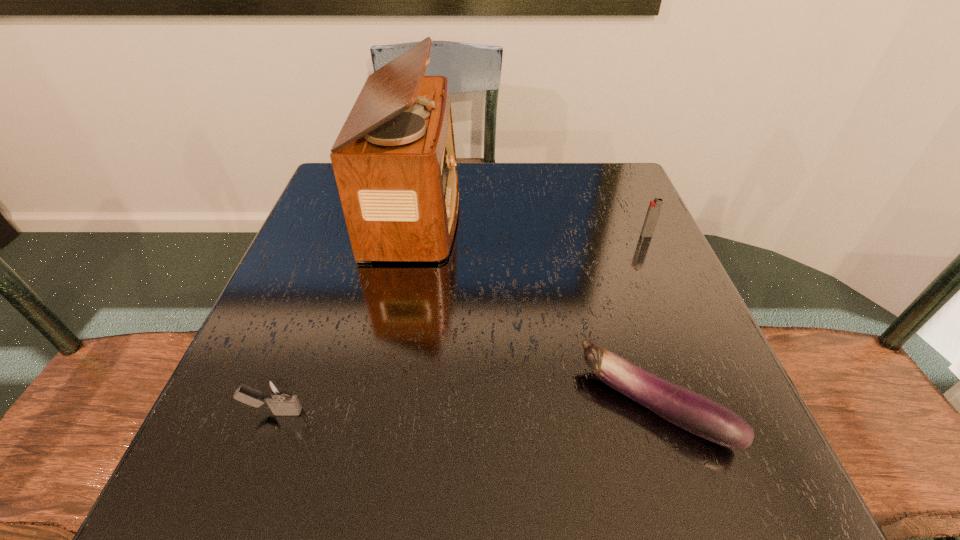
You are a GUI agent. You are given a task and a screenshot of the screen. Output one action in this format:
    pyautogui.click(x=<x>, y=<y>)
    Task: Click on the vacant space that's between the radio receiver and the nearer igniter
    Image resolution: width=960 pixels, height=540 pixels.
    Given the screenshot: What is the action you would take?
    pyautogui.click(x=345, y=312)

The image size is (960, 540). I want to click on free spot between the second object from left to right and the farther igniter, so click(x=531, y=223).

Find the location of `free space between the tallest object and the farther igniter`. free space between the tallest object and the farther igniter is located at coordinates (531, 223).

This screenshot has width=960, height=540. What are the coordinates of `vacant area between the leftmost object and the tallest object` in the screenshot? It's located at (345, 312).

The width and height of the screenshot is (960, 540). Find the location of `object that stands as the second closest to the right igniter`. object that stands as the second closest to the right igniter is located at coordinates (394, 161).

Identify which object is the nearest to the right igniter. Please provide its 2D coordinates. Your answer should be formatted as a tuple, i.e. [(x, y)], where the tuple contains the x and y coordinates of a point satisfying the conditions above.

[(694, 412)]

Find the location of `blank space that satisfies the following two spatial constraints: 1. on the front panel of the tallest object; 2. on the left side of the farther igniter`. blank space that satisfies the following two spatial constraints: 1. on the front panel of the tallest object; 2. on the left side of the farther igniter is located at coordinates (411, 235).

The width and height of the screenshot is (960, 540). I want to click on vacant region that satisfies the following two spatial constraints: 1. on the front panel of the eggplant; 2. on the left side of the tallest object, so click(x=380, y=404).

Identify the location of free space that satisfies the following two spatial constraints: 1. on the front panel of the third object from right to left; 2. on the left side of the eggplant. (380, 404).

The height and width of the screenshot is (540, 960). Identify the location of vacant position in the image that satisfies the following two spatial constraints: 1. on the front panel of the eggplant; 2. on the left side of the tallest object. (380, 404).